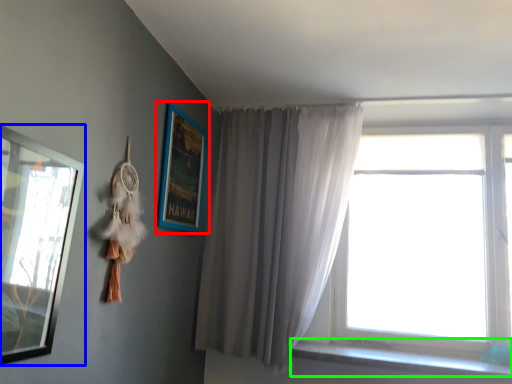
Question: Estimate the real-world distances between objects in this image. Which object is closer to picture frame (highlighted by a red box), picture frame (highlighted by a blue box) or window sill (highlighted by a green box)?

Choices:
 (A) picture frame
 (B) window sill

Answer: (A)